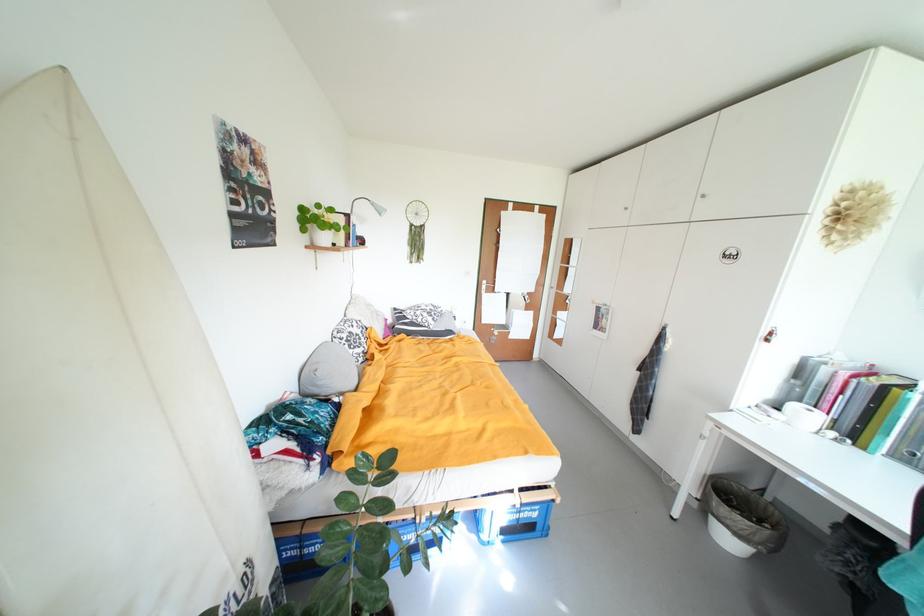
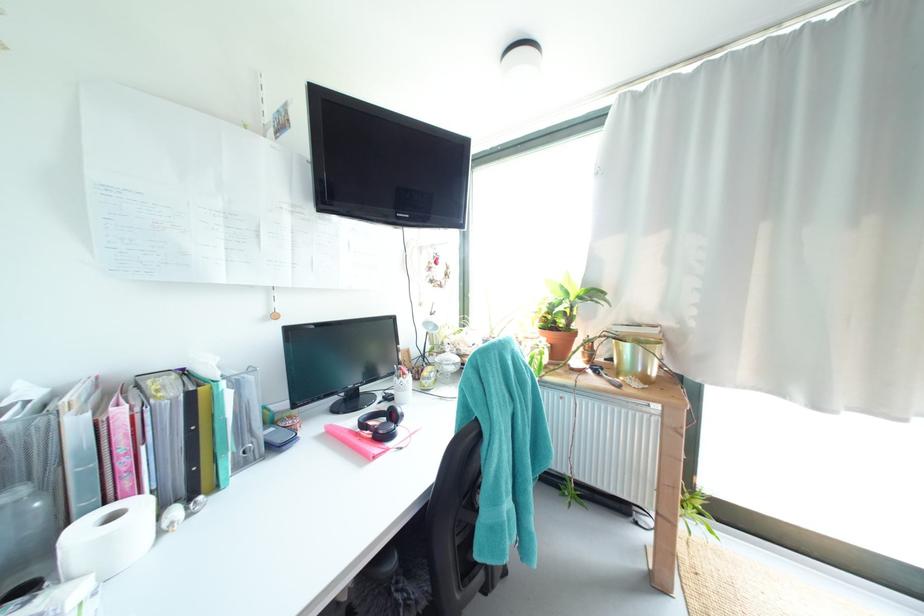
Where in the second image is the point corresponding to (833,408) from the first image?

(135, 485)